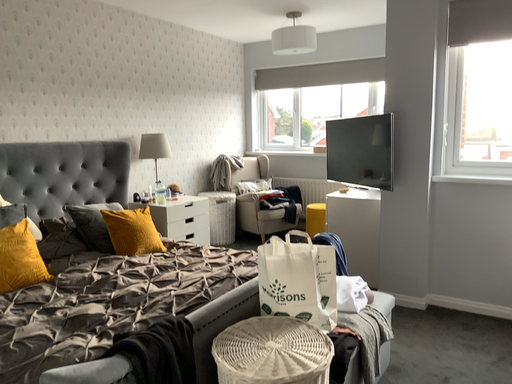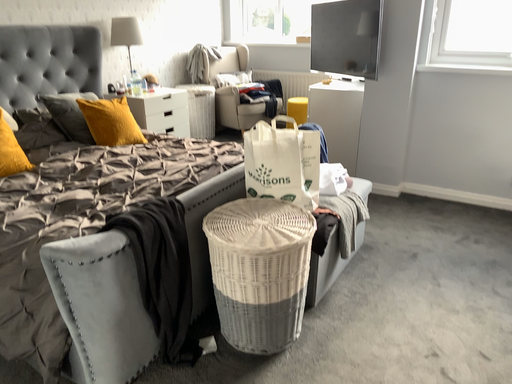
Question: Which way did the camera rotate in the video?

Choices:
 (A) rotated upward
 (B) rotated downward

Answer: (B)